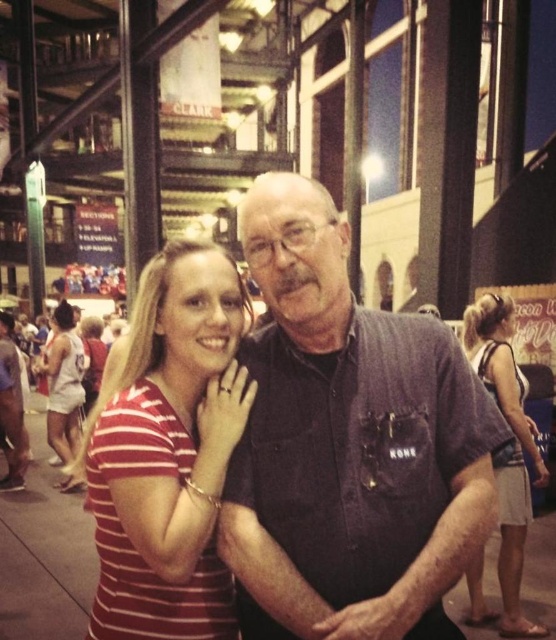
You are standing at the point labeled point (x=504, y=321) and want to walk to the exit located at point (x=348, y=598). Since you can only move forward, will you be able to see the exit directly ahead of you without any obstructions?

Yes, since point (x=348, y=598) is in front of point (x=504, y=321), the exit at point (x=348, y=598) will be directly ahead and visible without obstructions.

You are a photographer at the event and need to capture a photo that includes both the dark blue shirt at center and the white jersey at left. Based on their positions, which one should you ensure is in the foreground to include both clearly?

The dark blue shirt at center should be in the foreground because it is positioned over the white jersey at left, meaning it is closer to the camera. By placing it in the foreground, both will be visible without one blocking the other too much.

You are a photographer at the event and need to position a camera stand between the dark blue shirt at center and the light brown textured shorts at lower right. Since the stand requires a minimum of 1 meter of space between the two objects, can you determine if there is enough space based on their heights?

The dark blue shirt at center is shorter than the light brown textured shorts at lower right, but their heights do not provide information about the distance between them. The question about space between them cannot be answered with the given information.